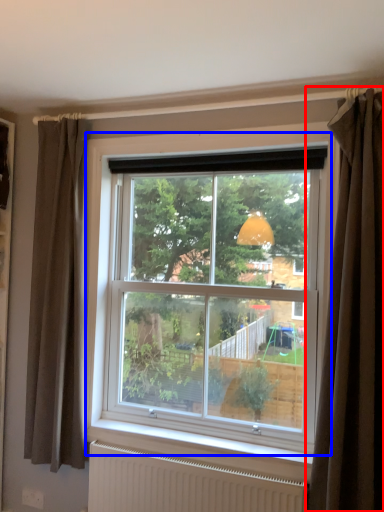
Question: Which object appears closest to the camera in this image, curtain (highlighted by a red box) or window (highlighted by a blue box)?

Choices:
 (A) curtain
 (B) window

Answer: (A)